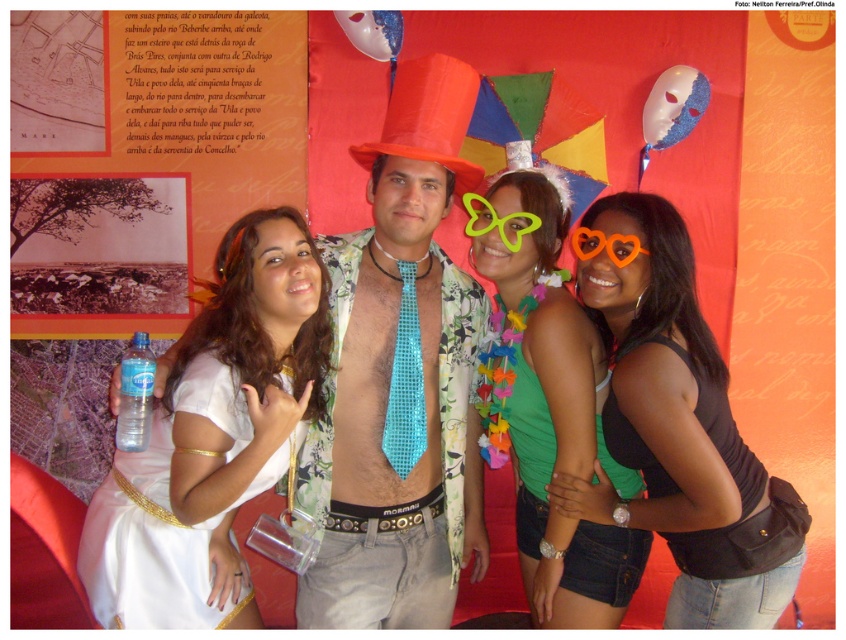
In the scene shown: You are a photographer at the event and need to position the white satin dress at center and the shiny plastic party hat at center for a group photo. Based on their current positions, which object should you move to the right to align them properly?

The white satin dress at center should be moved to the right to align with the shiny plastic party hat at center since it is currently to the left of it.